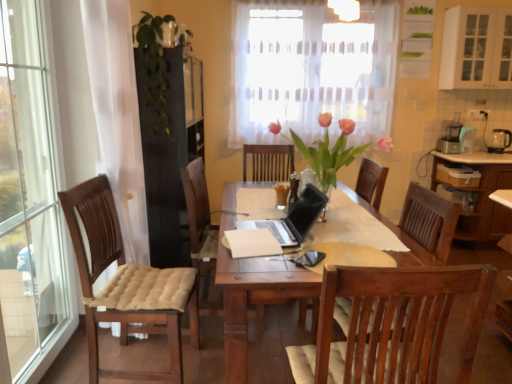
The height and width of the screenshot is (384, 512). Identify the location of free space in front of black glass kettle at right. (502, 154).